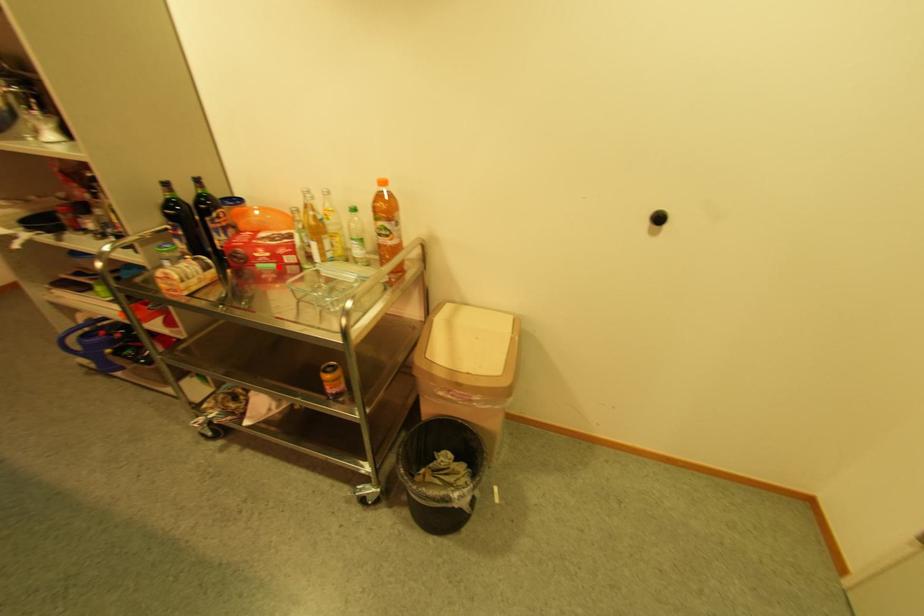
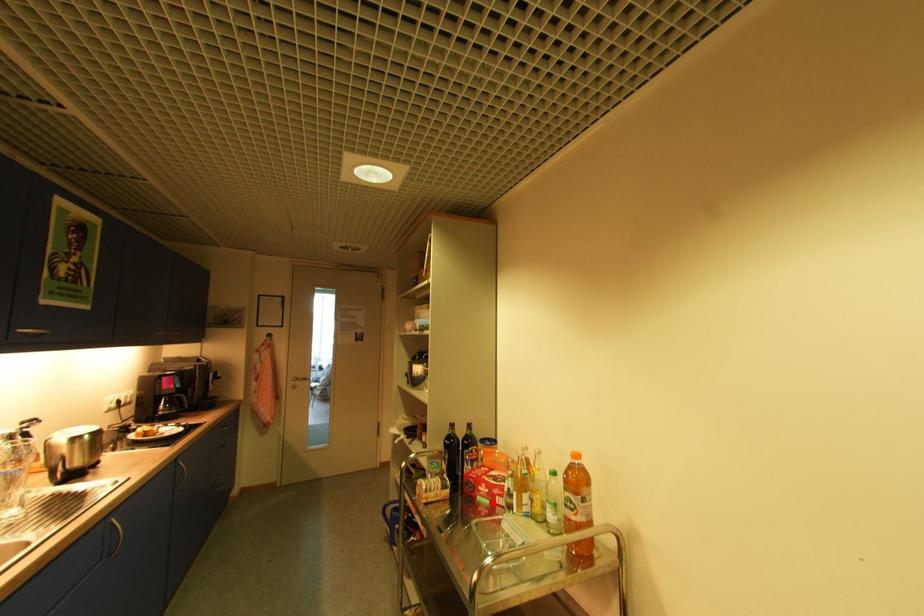
Consider the image. I am providing you with two images of the same scene from different viewpoints. A red point is marked on the first image and another point is marked on the second image. Are the points marked in image1 and image2 representing the same 3D position?

Yes